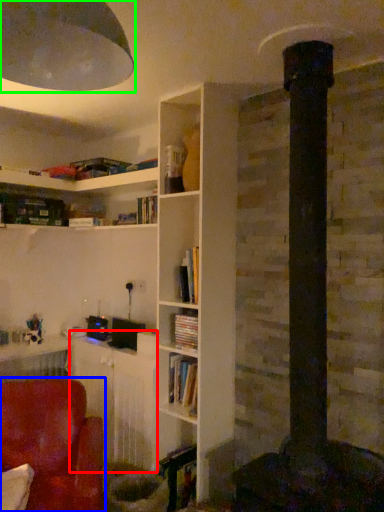
Question: Which object is the farthest from table (highlighted by a red box)? Choose among these: chair (highlighted by a blue box) or lamp (highlighted by a green box).

Choices:
 (A) chair
 (B) lamp

Answer: (B)